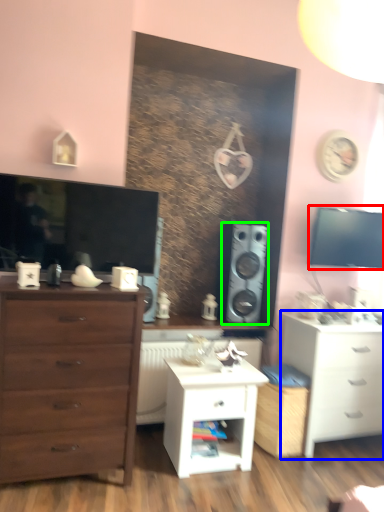
Question: Which is nearer to the window screen (highlighted by a red box)? chest of drawers (highlighted by a blue box) or speaker (highlighted by a green box).

Choices:
 (A) chest of drawers
 (B) speaker

Answer: (B)